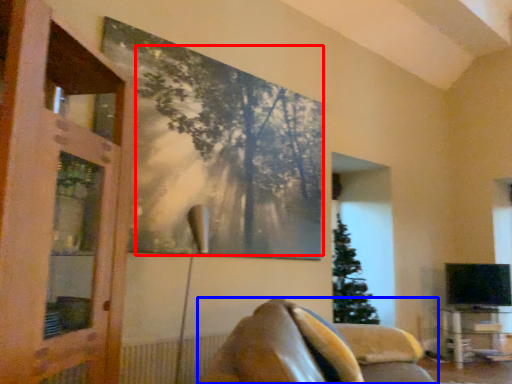
Question: Which point is closer to the camera, tree (highlighted by a red box) or furniture (highlighted by a blue box)?

Choices:
 (A) tree
 (B) furniture

Answer: (B)